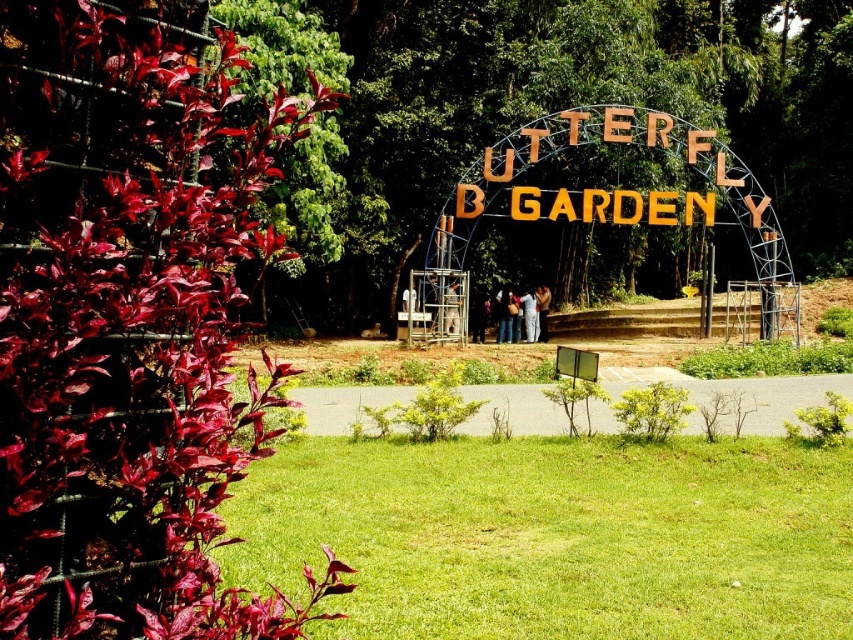
Does metallic scaffolding at center appear under purple fabric at center?

Incorrect, metallic scaffolding at center is not positioned below purple fabric at center.

Which is behind, point (444, 291) or point (474, 330)?

The point (474, 330) is more distant.

This screenshot has width=853, height=640. Identify the location of metallic scaffolding at center. (436, 305).

Based on the photo, does metallic scaffolding at center come in front of matte blue shirt at center?

Yes, metallic scaffolding at center is in front of matte blue shirt at center.

Who is positioned more to the right, metallic scaffolding at center or matte blue shirt at center?

matte blue shirt at center

What do you see at coordinates (436, 305) in the screenshot? The width and height of the screenshot is (853, 640). I see `metallic scaffolding at center` at bounding box center [436, 305].

Where is `metallic scaffolding at center`? The height and width of the screenshot is (640, 853). metallic scaffolding at center is located at coordinates (436, 305).

Who is higher up, metallic silver person at center or light brown wooden sign at center?

light brown wooden sign at center is above.

Does point (451, 288) come behind point (538, 321)?

No, (451, 288) is in front of (538, 321).

The width and height of the screenshot is (853, 640). Identify the location of metallic silver person at center. (451, 308).

This screenshot has width=853, height=640. Find the location of `metallic silver person at center`. metallic silver person at center is located at coordinates (451, 308).